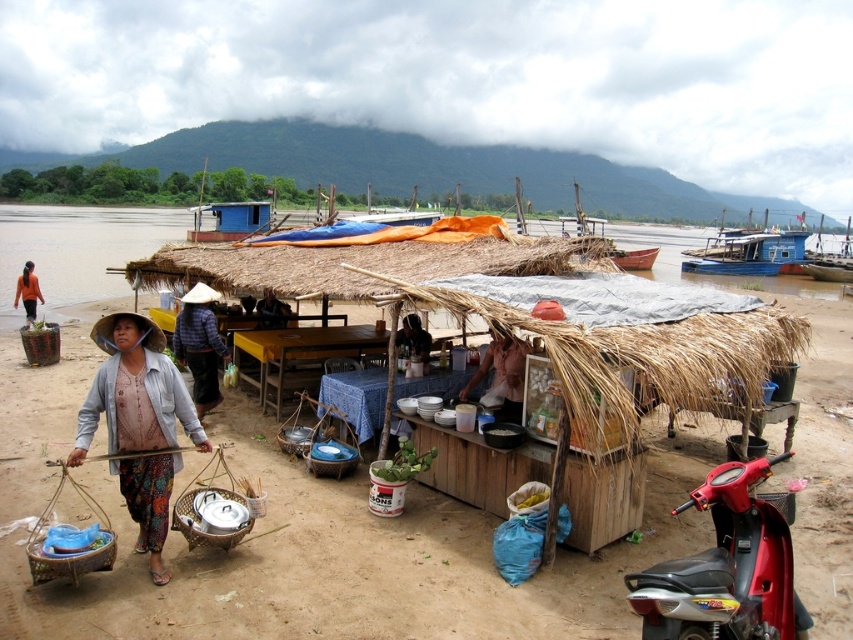
You are a tourist standing at the riverside and want to take a photo of the brown thatch hut at center and the dark blue fabric at center. Which object should you focus on first to ensure both are in the frame?

You should focus on the brown thath hut at center first because it is closer to you than the dark blue fabric at center, so adjusting the camera to capture it ensures the dark blue fabric at center will also be in the frame.

You are a customer at the riverside food stall and want to grab both the light pink fabric at center and the matte black shirt at center. Which one should you reach for first based on their positions?

You should reach for the light pink fabric at center first because it is closer to you than the matte black shirt at center.

You are a customer at the riverside stall and you see the light pink fabric at center and the matte black shirt at center. Which one is higher up?

The light pink fabric at center is much taller than the matte black shirt at center, so the light pink fabric at center is higher up.